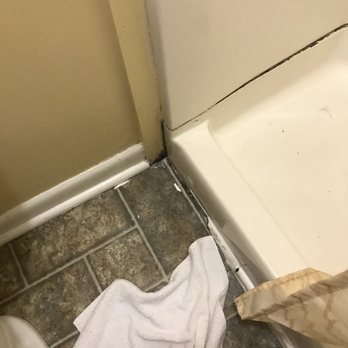
Identify the location of water damage to molding. (164, 157).